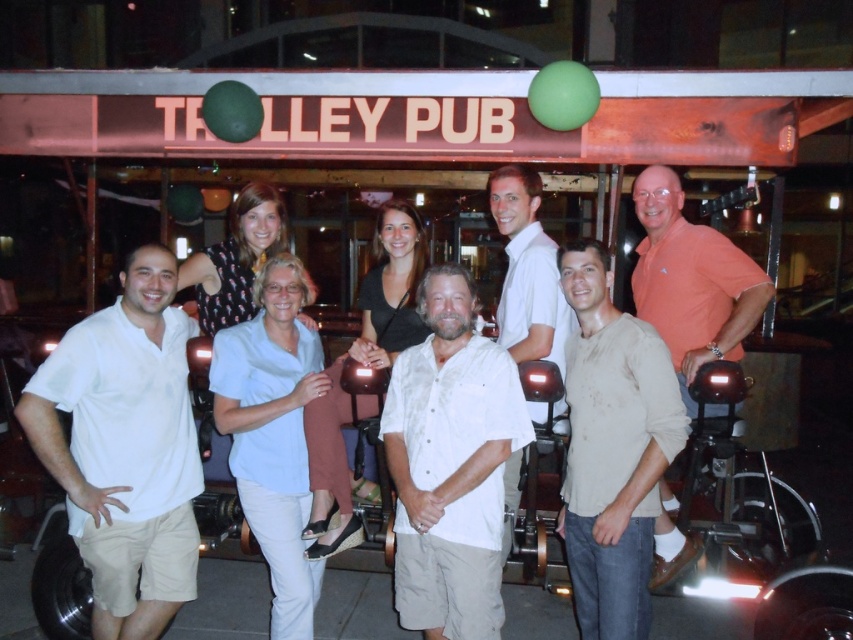
Question: Which object is closer to the camera taking this photo?

Choices:
 (A) orange cotton polo shirt at right
 (B) light beige cotton shirt at center

Answer: (B)

Question: Does white textured shirt at center lie behind light blue cotton shirt at center?

Choices:
 (A) no
 (B) yes

Answer: (A)

Question: Which point is farther to the camera?

Choices:
 (A) (592, 547)
 (B) (457, 520)
 (C) (77, 449)
 (D) (251, 333)

Answer: (D)

Question: Is light beige cotton shirt at center bigger than light blue cotton shirt at center?

Choices:
 (A) no
 (B) yes

Answer: (B)

Question: Considering the relative positions of white cotton shirt at left and white cotton shirt at center in the image provided, where is white cotton shirt at left located with respect to white cotton shirt at center?

Choices:
 (A) above
 (B) below

Answer: (B)

Question: Which object appears closest to the camera in this image?

Choices:
 (A) white cotton shirt at left
 (B) white textured shirt at center
 (C) light beige cotton shirt at center

Answer: (C)